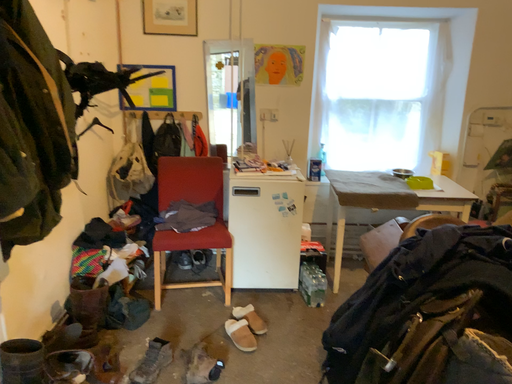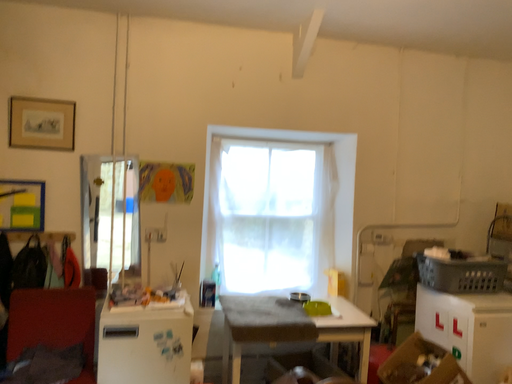
Question: Which way did the camera rotate in the video?

Choices:
 (A) rotated upward
 (B) rotated downward

Answer: (A)